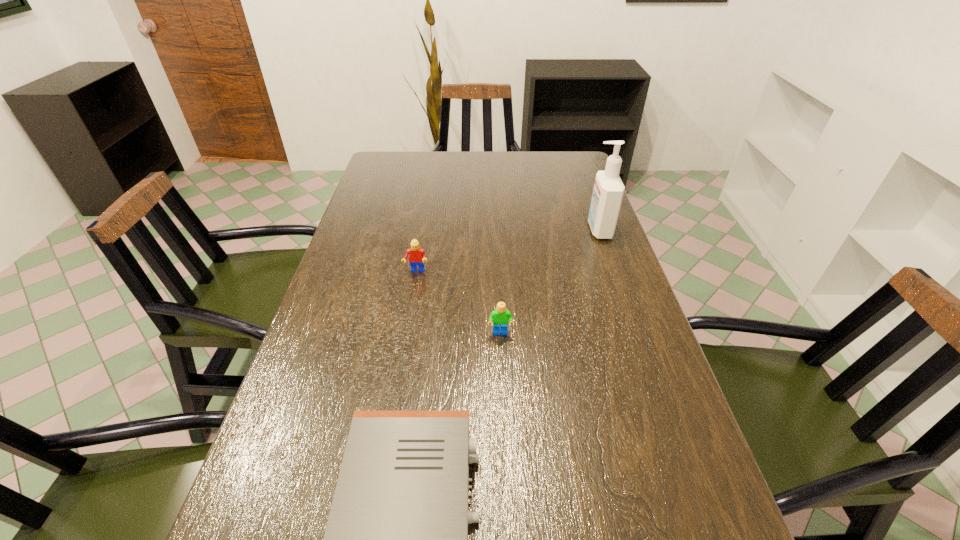
You are a GUI agent. You are given a task and a screenshot of the screen. Output one action in this format:
    pyautogui.click(x=<x>, y=<y>)
    Task: Click on the farthest object
    The image size is (960, 540).
    Given the screenshot: What is the action you would take?
    pyautogui.click(x=608, y=191)

What are the coordinates of `the tallest object` in the screenshot? It's located at (608, 191).

The width and height of the screenshot is (960, 540). What are the coordinates of `the left Lego` in the screenshot? It's located at (416, 255).

Locate an element on the screen. The image size is (960, 540). the farther Lego is located at coordinates (416, 255).

Find the location of `the second object from right to left`. the second object from right to left is located at coordinates (500, 317).

Identify the location of the nearer Lego. 500,317.

I want to click on vacant area situated 0.390m on the front label of the rightmost object, so click(459, 230).

This screenshot has width=960, height=540. Find the location of `free region located 0.310m on the front label of the rightmost object`. free region located 0.310m on the front label of the rightmost object is located at coordinates (486, 230).

In order to click on vacant space located on the front label of the rightmost object in this screenshot , I will do `click(567, 230)`.

Identify the location of vacant space located on the front-facing side of the farther Lego. (396, 384).